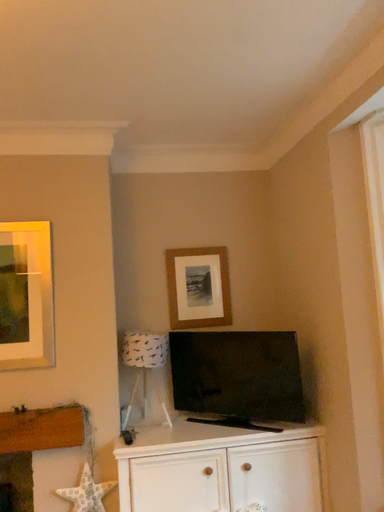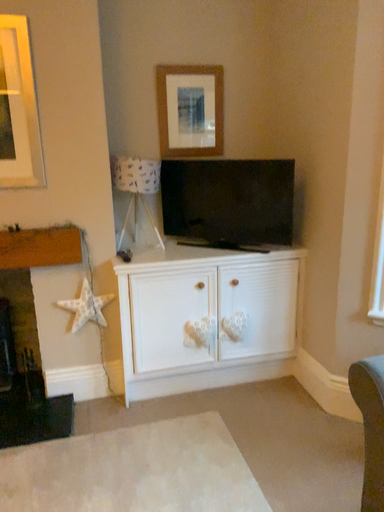
Question: How did the camera likely rotate when shooting the video?

Choices:
 (A) rotated upward
 (B) rotated downward

Answer: (B)